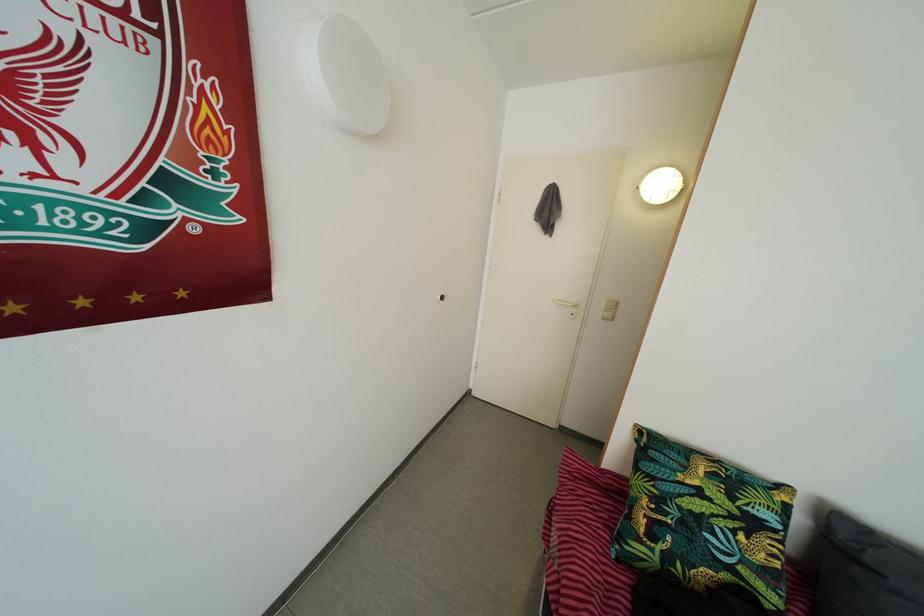
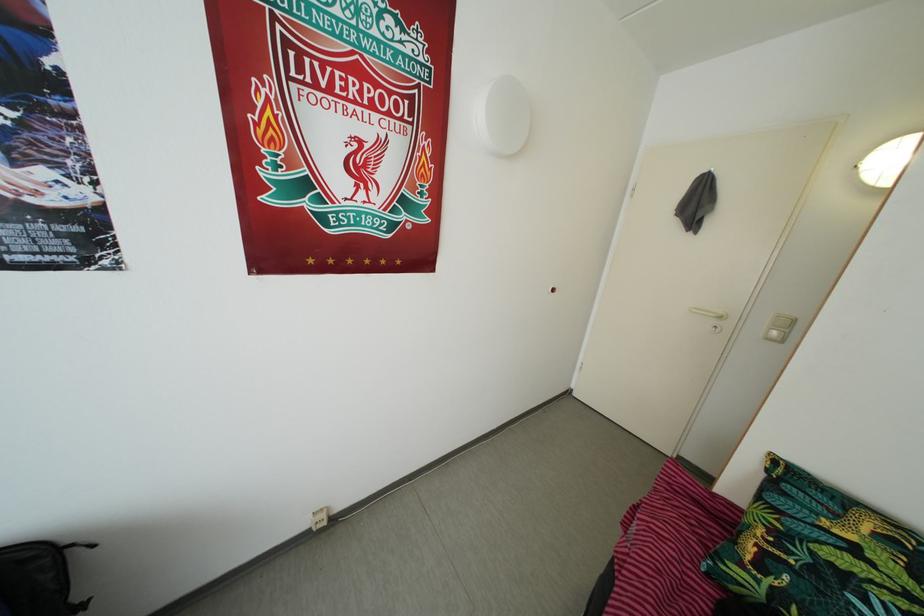
In the second image, find the point that corresponds to (x=688, y=531) in the first image.

(820, 578)